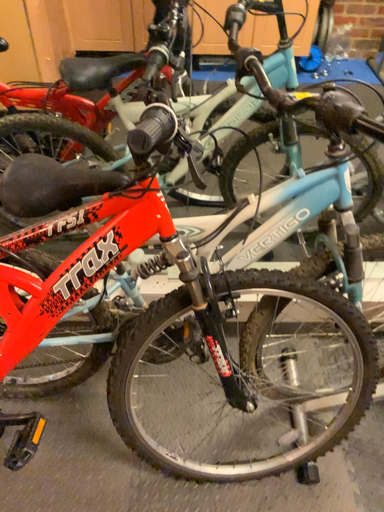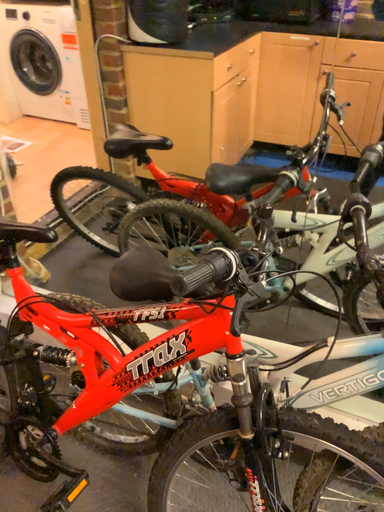
Question: Which way did the camera rotate in the video?

Choices:
 (A) rotated downward
 (B) rotated upward

Answer: (B)